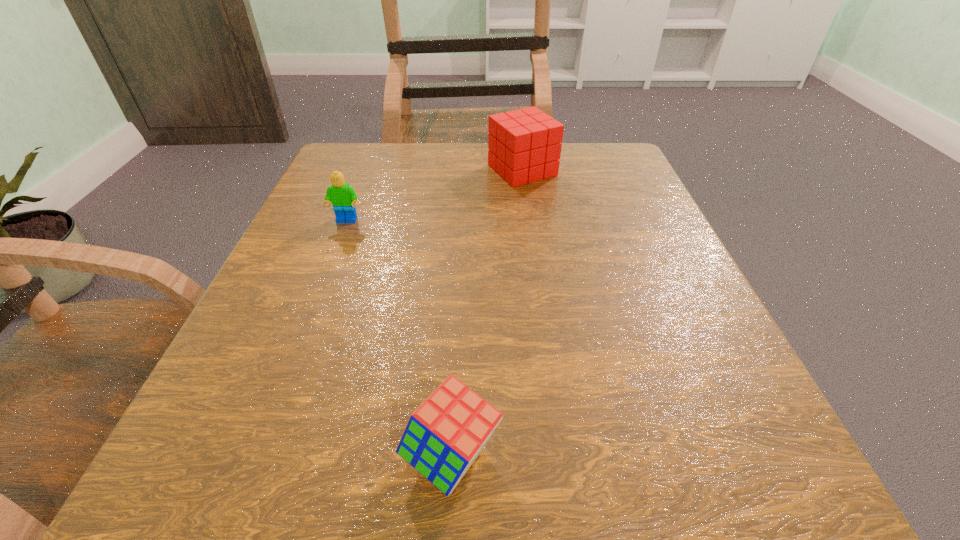
At what (x,y) coordinates should I click in order to perform the action: click on empty location between the farthest object and the nearer cube. Please return your answer as a coordinate pair (x, y). Looking at the image, I should click on (487, 313).

The image size is (960, 540). Find the location of `vacant space that's between the Lego and the nearer cube`. vacant space that's between the Lego and the nearer cube is located at coordinates (399, 339).

Where is `free space between the leftmost object and the farther cube`? This screenshot has height=540, width=960. free space between the leftmost object and the farther cube is located at coordinates (435, 195).

The width and height of the screenshot is (960, 540). I want to click on vacant space that is in between the leftmost object and the nearest object, so click(399, 339).

Locate an element on the screen. free spot between the second nearest object and the farther cube is located at coordinates (435, 195).

At what (x,y) coordinates should I click in order to perform the action: click on free space between the shorter cube and the second farthest object. Please return your answer as a coordinate pair (x, y). This screenshot has width=960, height=540. Looking at the image, I should click on (399, 339).

This screenshot has width=960, height=540. I want to click on unoccupied position between the farthest object and the nearest object, so click(487, 313).

You are a GUI agent. You are given a task and a screenshot of the screen. Output one action in this format:
    pyautogui.click(x=<x>, y=<y>)
    Task: Click on the free space that is in between the farthest object and the shorter cube
    The width and height of the screenshot is (960, 540).
    Given the screenshot: What is the action you would take?
    pyautogui.click(x=487, y=313)

Image resolution: width=960 pixels, height=540 pixels. In order to click on vacant space that is in between the leftmost object and the nearest object in this screenshot , I will do click(x=399, y=339).

Locate an element on the screen. Image resolution: width=960 pixels, height=540 pixels. object that is the closest to the farther cube is located at coordinates (342, 196).